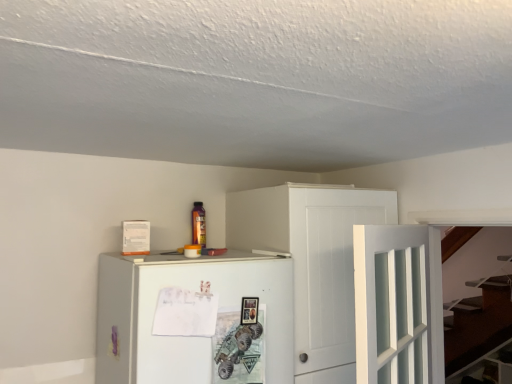
You are a GUI agent. You are given a task and a screenshot of the screen. Output one action in this format:
    pyautogui.click(x=<x>, y=<y>)
    Task: Click on the white matte refrigerator at center
    Image resolution: width=512 pixels, height=384 pixels.
    Given the screenshot: What is the action you would take?
    tap(194, 319)

Find the location of a particular element. white glass door at center-right is located at coordinates (398, 303).

In order to click on white wood cabinet at upper center in this screenshot , I will do `click(313, 262)`.

From the image's perspective, between white matte refrigerator at center and white glass door at center-right, which one is located above?

white glass door at center-right is shown above in the image.

From their relative heights in the image, would you say white matte refrigerator at center is taller or shorter than white glass door at center-right?

Considering their sizes, white matte refrigerator at center has less height than white glass door at center-right.

Is white matte refrigerator at center spatially inside white glass door at center-right, or outside of it?

white matte refrigerator at center is spatially situated outside white glass door at center-right.

Is point (341, 192) in front of point (264, 341)?

No, it is not.

Based on the photo, from the image's perspective, is white wood cabinet at upper center located above white matte refrigerator at center?

Yes, from the image's perspective, white wood cabinet at upper center is on top of white matte refrigerator at center.

Between white wood cabinet at upper center and white matte refrigerator at center, which one is positioned behind?

white wood cabinet at upper center is behind.

How much distance is there between white wood cabinet at upper center and white matte refrigerator at center?

The distance of white wood cabinet at upper center from white matte refrigerator at center is 13.64 inches.

Is white glass door at center-right not close to white matte refrigerator at center?

No.

From a real-world perspective, is white glass door at center-right positioned above or below white matte refrigerator at center?

white glass door at center-right is above white matte refrigerator at center.

Does point (426, 345) lie in front of point (109, 359)?

No, (426, 345) is further to viewer.

Is the depth of white matte refrigerator at center greater than that of white wood cabinet at upper center?

No.

Does white matte refrigerator at center have a lesser height compared to white wood cabinet at upper center?

Yes.

Which of these two, white matte refrigerator at center or white wood cabinet at upper center, is smaller?

With smaller size is white matte refrigerator at center.

Find the location of a particular element. The height and width of the screenshot is (384, 512). refrigerator in front of the white wood cabinet at upper center is located at coordinates (194, 319).

Is the depth of white glass door at center-right less than that of white wood cabinet at upper center?

Yes, white glass door at center-right is closer to the viewer.

Image resolution: width=512 pixels, height=384 pixels. Find the location of `cabinetry on the left of white glass door at center-right`. cabinetry on the left of white glass door at center-right is located at coordinates (313, 262).

Is white glass door at center-right aimed at white wood cabinet at upper center?

No, white glass door at center-right is not turned towards white wood cabinet at upper center.

Consider the image. Who is shorter, white glass door at center-right or white wood cabinet at upper center?

Answer: white glass door at center-right.

Is white wood cabinet at upper center in front of or behind white glass door at center-right in the image?

Clearly, white wood cabinet at upper center is behind white glass door at center-right.

From their relative heights in the image, would you say white wood cabinet at upper center is taller or shorter than white glass door at center-right?

Considering their sizes, white wood cabinet at upper center has more height than white glass door at center-right.

From the image's perspective, is white wood cabinet at upper center located above white glass door at center-right?

No, from the image's perspective, white wood cabinet at upper center is not above white glass door at center-right.

This screenshot has width=512, height=384. In order to click on door in front of the white wood cabinet at upper center in this screenshot , I will do `click(398, 303)`.

The image size is (512, 384). Identify the location of door above the white matte refrigerator at center (from a real-world perspective). (398, 303).

Where is `cabinetry on the right of the white matte refrigerator at center`? cabinetry on the right of the white matte refrigerator at center is located at coordinates (313, 262).

Considering their positions, is white glass door at center-right positioned further to white matte refrigerator at center than white wood cabinet at upper center?

white glass door at center-right is positioned further to the anchor white matte refrigerator at center.

Which object lies nearer to the anchor point white glass door at center-right, white wood cabinet at upper center or white matte refrigerator at center?

white wood cabinet at upper center is closer to white glass door at center-right.

Estimate the real-world distances between objects in this image. Which object is closer to white glass door at center-right, white matte refrigerator at center or white wood cabinet at upper center?

white wood cabinet at upper center is closer to white glass door at center-right.

Consider the image. Estimate the real-world distances between objects in this image. Which object is further from white wood cabinet at upper center, white glass door at center-right or white matte refrigerator at center?

Among the two, white glass door at center-right is located further to white wood cabinet at upper center.

Based on the photo, when comparing their distances from white matte refrigerator at center, does white wood cabinet at upper center or white glass door at center-right seem further?

white glass door at center-right.

Which object lies further to the anchor point white wood cabinet at upper center, white matte refrigerator at center or white glass door at center-right?

white glass door at center-right is further to white wood cabinet at upper center.

The image size is (512, 384). In order to click on cabinetry located between white matte refrigerator at center and white glass door at center-right in the left-right direction in this screenshot , I will do `click(313, 262)`.